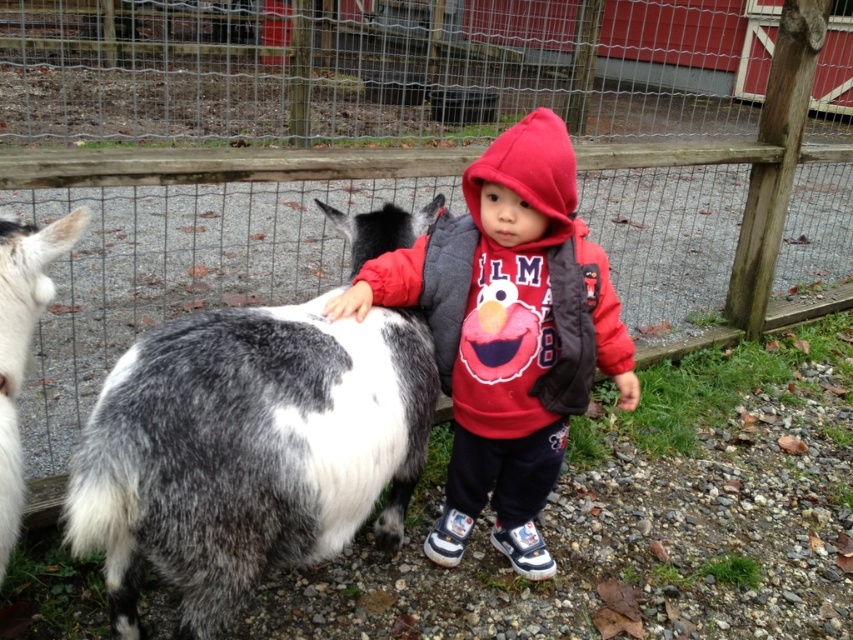
You are a farmer checking the goats in the pen. You notice two goats, the spotted fur goat at center and the white and gray fur goat at left. Which goat is located higher up in the image?

The spotted fur goat at center is positioned under the white and gray fur goat at left, so the white and gray fur goat at left is higher up in the image.

Consider the image. You are a farmer checking the space between two stalls. You see the spotted fur goat at center and the matte red hoodie at center. Which object is wider?

The spotted fur goat at center is wider than the matte red hoodie at center, as its width surpasses that of the hoodie.